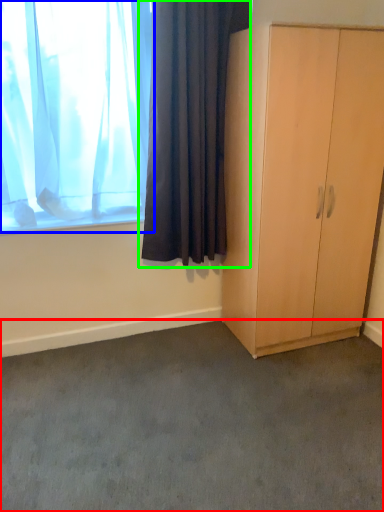
Question: Which is farther away from plain (highlighted by a red box)? curtain (highlighted by a blue box) or curtain (highlighted by a green box)?

Choices:
 (A) curtain
 (B) curtain

Answer: (A)